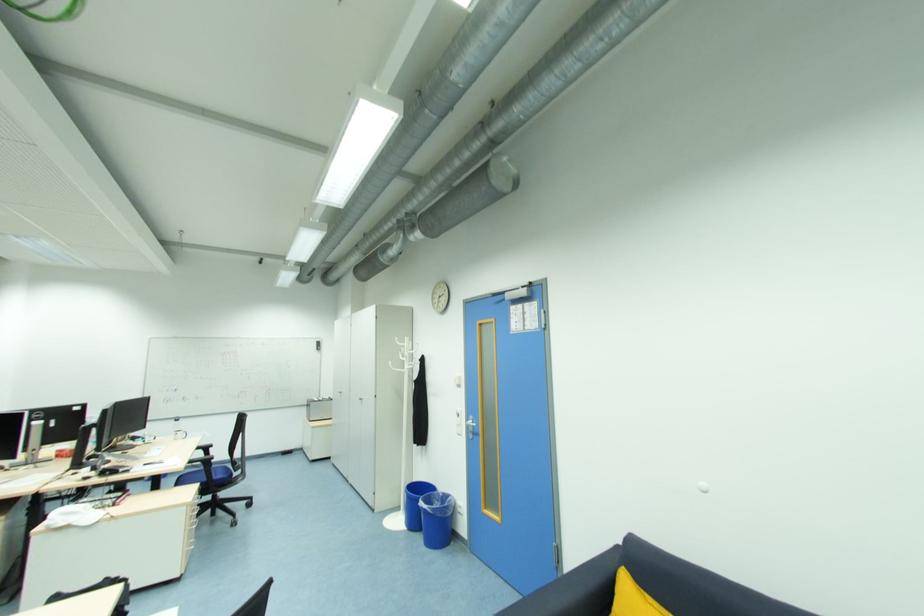
The location [440,521] corresponds to which object?

It corresponds to the blue trash can in the image.